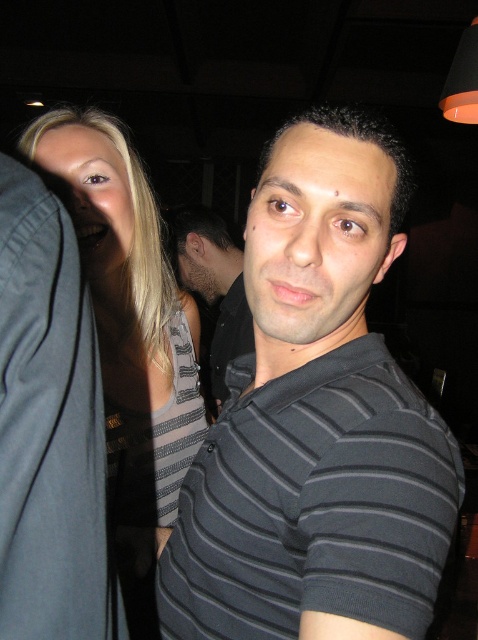
Question: Does dark gray striped polo shirt at center appear under black striped shirt at center?

Choices:
 (A) no
 (B) yes

Answer: (B)

Question: Is blonde hair at left below black striped shirt at center?

Choices:
 (A) no
 (B) yes

Answer: (B)

Question: Which object appears farthest from the camera in this image?

Choices:
 (A) black striped shirt at center
 (B) blonde hair at left
 (C) dark gray striped polo shirt at center

Answer: (A)

Question: Can you confirm if dark gray striped polo shirt at center is bigger than blonde hair at left?

Choices:
 (A) yes
 (B) no

Answer: (B)

Question: Which object is farther from the camera taking this photo?

Choices:
 (A) blonde hair at left
 (B) dark gray striped polo shirt at center
 (C) black striped shirt at center

Answer: (C)

Question: Which object is positioned farthest from the dark gray striped polo shirt at center?

Choices:
 (A) black striped shirt at center
 (B) blonde hair at left

Answer: (A)